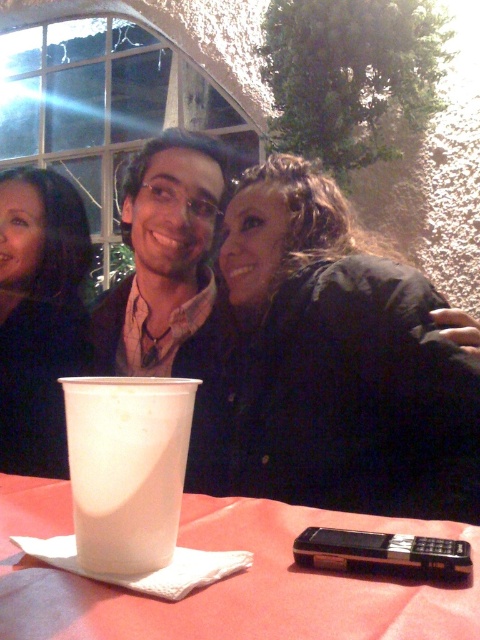
Question: Can you confirm if white paper cup at center is positioned to the left of matte black hair at upper left?

Choices:
 (A) yes
 (B) no

Answer: (B)

Question: In this image, where is white paper cup at center located relative to matte black hair at upper left?

Choices:
 (A) left
 (B) right

Answer: (B)

Question: Is black matte jacket at center positioned before matte black hair at upper left?

Choices:
 (A) yes
 (B) no

Answer: (A)

Question: Which object is positioned closest to the matte black hair at upper left?

Choices:
 (A) black matte jacket at center
 (B) white paper cup at center

Answer: (A)

Question: Which point appears closest to the camera in this image?

Choices:
 (A) (12, 221)
 (B) (118, 292)
 (C) (450, 360)
 (D) (22, 595)

Answer: (D)

Question: Which of the following is the farthest from the observer?

Choices:
 (A) (294, 248)
 (B) (180, 394)
 (C) (36, 433)

Answer: (C)